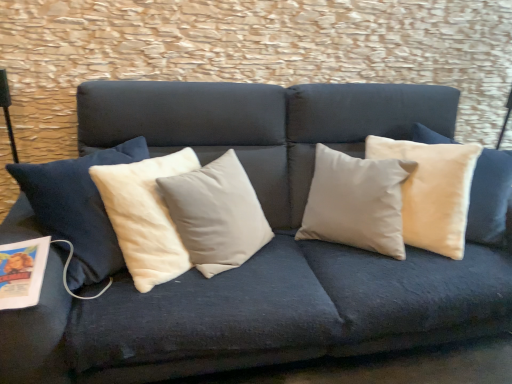
The height and width of the screenshot is (384, 512). What do you see at coordinates (22, 272) in the screenshot?
I see `matte paper magazine at lower left` at bounding box center [22, 272].

Image resolution: width=512 pixels, height=384 pixels. Find the location of `matte paper magazine at lower left`. matte paper magazine at lower left is located at coordinates (22, 272).

This screenshot has width=512, height=384. In order to click on beige velvet pillow at upper right in this screenshot , I will do `click(432, 191)`.

What is the approximate height of beige velvet pillow at upper right?

beige velvet pillow at upper right is 26.47 inches in height.

Describe the element at coordinates (432, 191) in the screenshot. I see `beige velvet pillow at upper right` at that location.

You are a GUI agent. You are given a task and a screenshot of the screen. Output one action in this format:
    pyautogui.click(x=<x>, y=<y>)
    Task: Click on the matte paper magazine at lower left
    This screenshot has height=384, width=512.
    Given the screenshot: What is the action you would take?
    pyautogui.click(x=22, y=272)

Is matte paper magazine at lower left to the left of beige velvet pillow at upper right from the viewer's perspective?

Yes, matte paper magazine at lower left is to the left of beige velvet pillow at upper right.

Considering their positions, is matte paper magazine at lower left located in front of or behind beige velvet pillow at upper right?

matte paper magazine at lower left is in front of beige velvet pillow at upper right.

Consider the image. Which is more distant, (x=23, y=284) or (x=413, y=232)?

Point (x=413, y=232)

From the image's perspective, is matte paper magazine at lower left above beige velvet pillow at upper right?

No, from the image's perspective, matte paper magazine at lower left is not on top of beige velvet pillow at upper right.

From a real-world perspective, is matte paper magazine at lower left above or below beige velvet pillow at upper right?

In terms of real-world spatial position, matte paper magazine at lower left is below beige velvet pillow at upper right.

Does matte paper magazine at lower left have a greater width compared to beige velvet pillow at upper right?

No, matte paper magazine at lower left is not wider than beige velvet pillow at upper right.

Considering the sizes of matte paper magazine at lower left and beige velvet pillow at upper right in the image, is matte paper magazine at lower left taller or shorter than beige velvet pillow at upper right?

Clearly, matte paper magazine at lower left is shorter compared to beige velvet pillow at upper right.

Between matte paper magazine at lower left and beige velvet pillow at upper right, which one has smaller size?

matte paper magazine at lower left.

Is matte paper magazine at lower left inside or outside of beige velvet pillow at upper right?

matte paper magazine at lower left is outside beige velvet pillow at upper right.

Would you consider matte paper magazine at lower left to be distant from beige velvet pillow at upper right?

Indeed, matte paper magazine at lower left is not near beige velvet pillow at upper right.

Looking at this image, does matte paper magazine at lower left turn towards beige velvet pillow at upper right?

No, matte paper magazine at lower left is not aimed at beige velvet pillow at upper right.

What's the angular difference between matte paper magazine at lower left and beige velvet pillow at upper right's facing directions?

The angle between the facing direction of matte paper magazine at lower left and the facing direction of beige velvet pillow at upper right is 24.7 degrees.

At what (x,y) coordinates should I click in order to perform the action: click on magazine that is below the beige velvet pillow at upper right (from the image's perspective). Please return your answer as a coordinate pair (x, y). Image resolution: width=512 pixels, height=384 pixels. Looking at the image, I should click on (22, 272).

Considering the relative positions of beige velvet pillow at upper right and matte paper magazine at lower left in the image provided, is beige velvet pillow at upper right to the right of matte paper magazine at lower left from the viewer's perspective?

Indeed, beige velvet pillow at upper right is positioned on the right side of matte paper magazine at lower left.

Is beige velvet pillow at upper right in front of or behind matte paper magazine at lower left in the image?

Visually, beige velvet pillow at upper right is located behind matte paper magazine at lower left.

Does point (398, 143) lie behind point (36, 291)?

Yes.

From the image's perspective, is beige velvet pillow at upper right located above matte paper magazine at lower left?

Yes.

From a real-world perspective, who is located lower, beige velvet pillow at upper right or matte paper magazine at lower left?

matte paper magazine at lower left.

Is beige velvet pillow at upper right thinner than matte paper magazine at lower left?

In fact, beige velvet pillow at upper right might be wider than matte paper magazine at lower left.

Based on the photo, can you confirm if beige velvet pillow at upper right is shorter than matte paper magazine at lower left?

No.

Between beige velvet pillow at upper right and matte paper magazine at lower left, which one has larger size?

beige velvet pillow at upper right is bigger.

Is matte paper magazine at lower left a part of beige velvet pillow at upper right?

No, matte paper magazine at lower left is not inside beige velvet pillow at upper right.

Are beige velvet pillow at upper right and matte paper magazine at lower left far apart?

Yes, beige velvet pillow at upper right is far from matte paper magazine at lower left.

Is beige velvet pillow at upper right positioned with its back to matte paper magazine at lower left?

beige velvet pillow at upper right does not have its back to matte paper magazine at lower left.

How different are the orientations of beige velvet pillow at upper right and matte paper magazine at lower left in degrees?

24.7 degrees separate the facing orientations of beige velvet pillow at upper right and matte paper magazine at lower left.

There is a matte paper magazine at lower left. Find the location of `pillow above it (from a real-world perspective)`. pillow above it (from a real-world perspective) is located at coordinates (432, 191).

Find the location of a particular element. This screenshot has height=384, width=512. magazine to the left of beige velvet pillow at upper right is located at coordinates (22, 272).

I want to click on pillow on the right of matte paper magazine at lower left, so click(x=432, y=191).